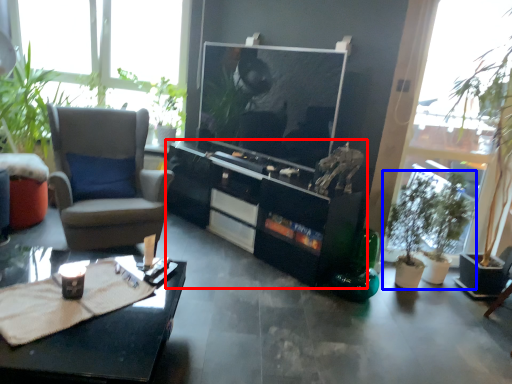
Question: Which object appears farthest to the camera in this image, cabinetry (highlighted by a red box) or houseplant (highlighted by a blue box)?

Choices:
 (A) cabinetry
 (B) houseplant

Answer: (B)